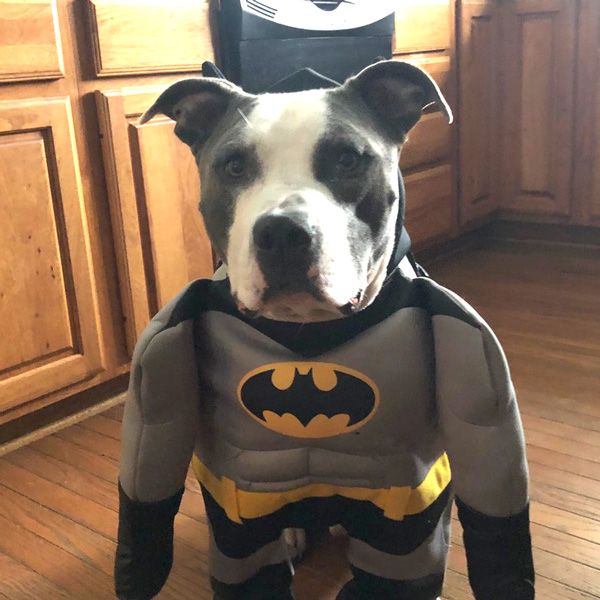
What are the coordinates of `cupboard` in the screenshot? It's located at (55, 257).